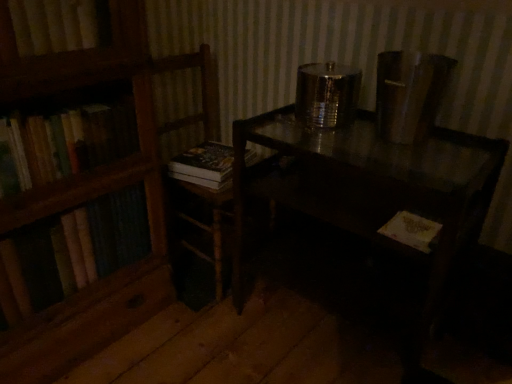
Question: Which direction should I rotate to look at hardcover book at center, which is the 2th book in front-to-back order, — up or down?

Choices:
 (A) down
 (B) up

Answer: (B)

Question: Does yellow paper book at lower right, which ranks as the first book in front-to-back order, have a larger size compared to hardcover book at center, the 1th book when ordered from top to bottom?

Choices:
 (A) yes
 (B) no

Answer: (B)

Question: Is yellow paper book at lower right, the 1th book positioned from the bottom, not within hardcover book at center, which is the 2th book in front-to-back order?

Choices:
 (A) yes
 (B) no

Answer: (A)

Question: Considering the relative sizes of yellow paper book at lower right, acting as the 2th book starting from the back, and hardcover book at center, the 1th book when ordered from top to bottom, in the image provided, is yellow paper book at lower right, acting as the 2th book starting from the back, wider than hardcover book at center, the 1th book when ordered from top to bottom,?

Choices:
 (A) yes
 (B) no

Answer: (B)

Question: Is hardcover book at center, the 1th book when ordered from top to bottom, a part of yellow paper book at lower right, which is the 2th book in top-to-bottom order?

Choices:
 (A) no
 (B) yes

Answer: (A)

Question: From a real-world perspective, is yellow paper book at lower right, acting as the 2th book starting from the back, positioned over hardcover book at center, the 1th book in the left-to-right sequence, based on gravity?

Choices:
 (A) yes
 (B) no

Answer: (A)

Question: Is yellow paper book at lower right, acting as the 2th book starting from the back, looking in the opposite direction of hardcover book at center, which is the 2th book in front-to-back order?

Choices:
 (A) yes
 (B) no

Answer: (B)

Question: Is hardcover book at center, the 1th book when ordered from top to bottom, bigger than yellow paper book at lower right, which is the 2th book in top-to-bottom order?

Choices:
 (A) no
 (B) yes

Answer: (B)

Question: Does hardcover book at center, which is counted as the 2th book, starting from the bottom, appear on the left side of yellow paper book at lower right, acting as the 2th book starting from the back?

Choices:
 (A) yes
 (B) no

Answer: (A)

Question: Is hardcover book at center, which is the 2th book in front-to-back order, aimed at yellow paper book at lower right, which ranks as the first book in front-to-back order?

Choices:
 (A) yes
 (B) no

Answer: (A)

Question: Is hardcover book at center, the second book viewed from the right, looking in the opposite direction of yellow paper book at lower right, the 1th book positioned from the bottom?

Choices:
 (A) no
 (B) yes

Answer: (A)

Question: Is there a large distance between hardcover book at center, which is the 2th book in front-to-back order, and yellow paper book at lower right, the 1th book positioned from the bottom?

Choices:
 (A) no
 (B) yes

Answer: (A)

Question: From a real-world perspective, is hardcover book at center, the 1th book in the left-to-right sequence, located higher than yellow paper book at lower right, the 1th book positioned from the bottom?

Choices:
 (A) no
 (B) yes

Answer: (A)

Question: From a real-world perspective, is shiny dark wood table at center under wooden chair at left?

Choices:
 (A) yes
 (B) no

Answer: (A)